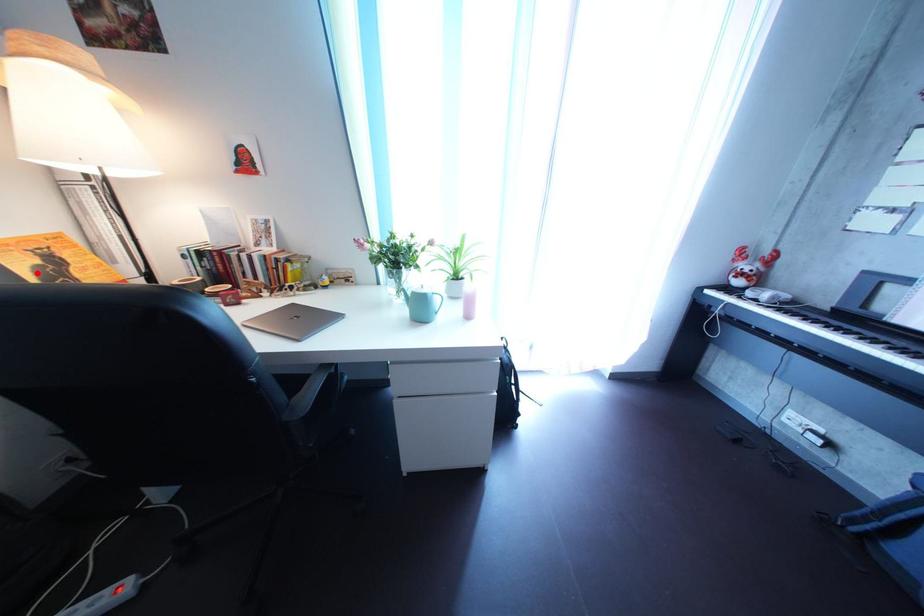
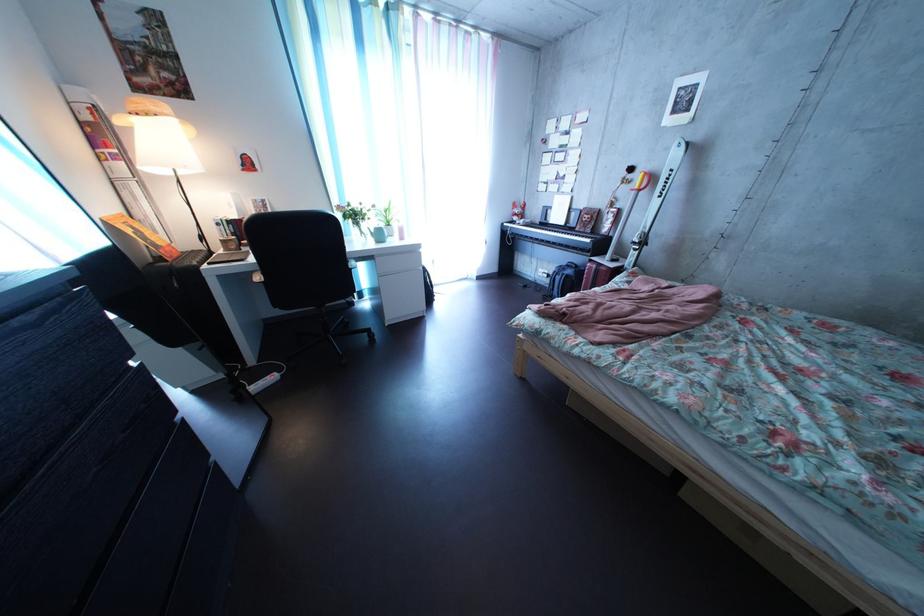
The point at the highlighted location is marked in the first image. Where is the corresponding point in the second image?

(142, 238)